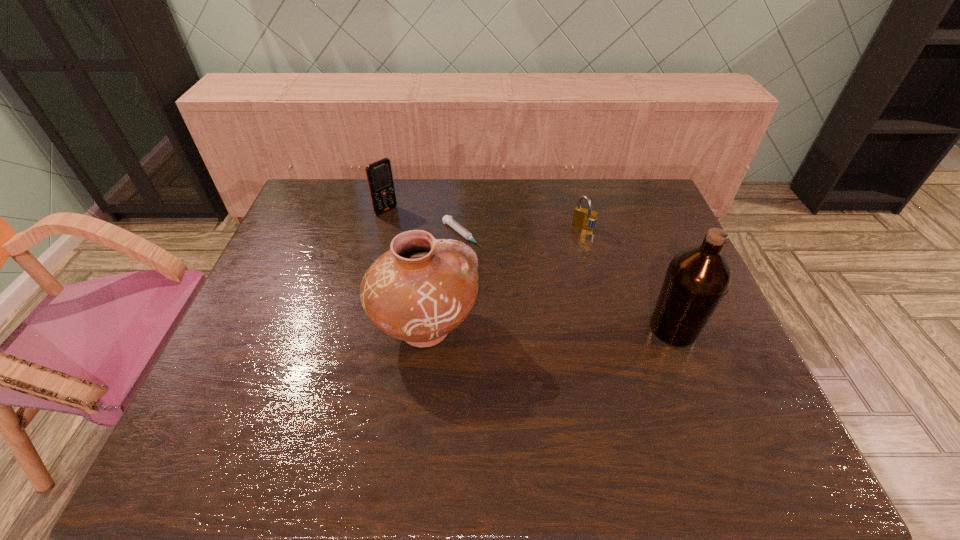
The width and height of the screenshot is (960, 540). Find the location of `blank space located 0.380m on the side with the combination dials of the padlock`. blank space located 0.380m on the side with the combination dials of the padlock is located at coordinates (534, 319).

Find the location of a particular element. free region located on the screen of the third tallest object is located at coordinates (462, 271).

The width and height of the screenshot is (960, 540). What are the coordinates of `vacant space positioned 0.100m on the screen of the third tallest object` in the screenshot? It's located at (410, 230).

Locate an element on the screen. The width and height of the screenshot is (960, 540). vacant space situated 0.390m on the screen of the third tallest object is located at coordinates (471, 278).

Identify the location of vacant area situated at the needle end of the syringe. The height and width of the screenshot is (540, 960). (567, 321).

Image resolution: width=960 pixels, height=540 pixels. What are the coordinates of `vacant position located 0.230m at the needle end of the syringe` in the screenshot? It's located at (529, 290).

Identify the location of vacant space located at the needle end of the syringe. This screenshot has width=960, height=540. click(576, 328).

I want to click on cellular telephone that is at the far edge, so click(x=379, y=176).

This screenshot has width=960, height=540. Find the location of `syringe that is positioned at the far edge`. syringe that is positioned at the far edge is located at coordinates (467, 235).

Where is `object that is at the right edge`? This screenshot has height=540, width=960. object that is at the right edge is located at coordinates (697, 278).